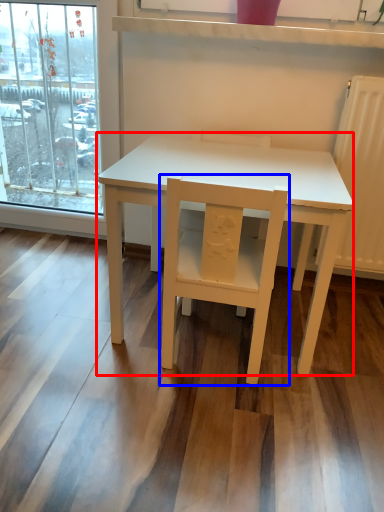
Question: Which object appears farthest to the camera in this image, table (highlighted by a red box) or chair (highlighted by a blue box)?

Choices:
 (A) table
 (B) chair

Answer: (A)